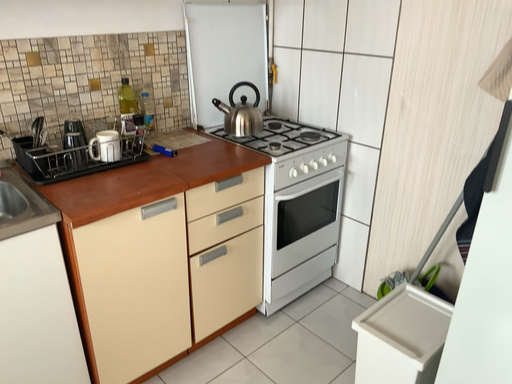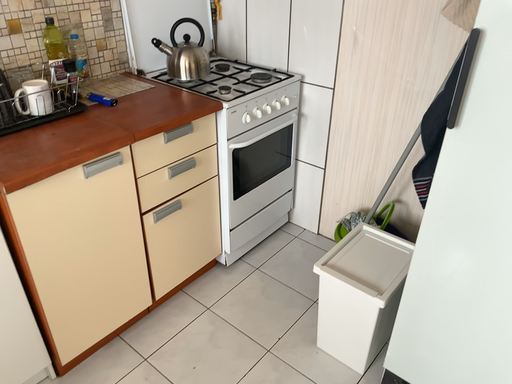
Question: Which way did the camera rotate in the video?

Choices:
 (A) rotated downward
 (B) rotated upward

Answer: (A)